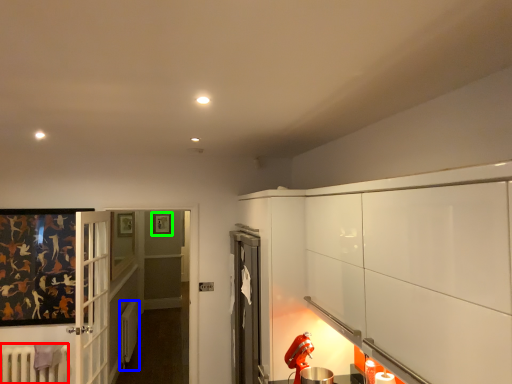
Question: Based on their relative distances, which object is farther from radiator (highlighted by a red box)? Choose from radiator (highlighted by a blue box) and picture frame (highlighted by a green box).

Choices:
 (A) radiator
 (B) picture frame

Answer: (B)